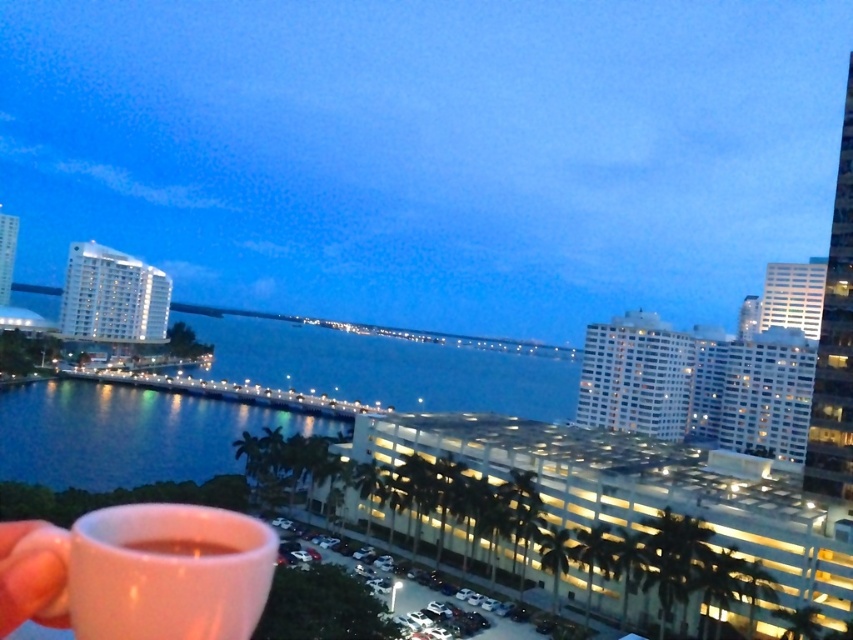
Can you confirm if white glossy building at upper left is thinner than translucent glass cup at lower left?

No.

Can you confirm if white glossy building at upper left is positioned to the right of translucent glass cup at lower left?

Incorrect, white glossy building at upper left is not on the right side of translucent glass cup at lower left.

Who is more distant from viewer, (141, 320) or (178, 540)?

The point (141, 320) is behind.

Where is `white glossy building at upper left`? The image size is (853, 640). white glossy building at upper left is located at coordinates (112, 296).

Between point (86, 474) and point (88, 243), which one is positioned in front?

Positioned in front is point (86, 474).

Can you confirm if blue water at center is shorter than white glossy building at upper left?

Yes, blue water at center is shorter than white glossy building at upper left.

At what (x,y) coordinates should I click in order to perform the action: click on blue water at center. Please return your answer as a coordinate pair (x, y). Looking at the image, I should click on (128, 433).

Identify the location of blue water at center. The image size is (853, 640). (128, 433).

Who is lower down, white concrete parking garage at center or pink matte cup at lower left?

Positioned lower is white concrete parking garage at center.

Looking at this image, between white concrete parking garage at center and pink matte cup at lower left, which one appears on the right side from the viewer's perspective?

From the viewer's perspective, white concrete parking garage at center appears more on the right side.

The image size is (853, 640). What are the coordinates of `white concrete parking garage at center` in the screenshot? It's located at 633,493.